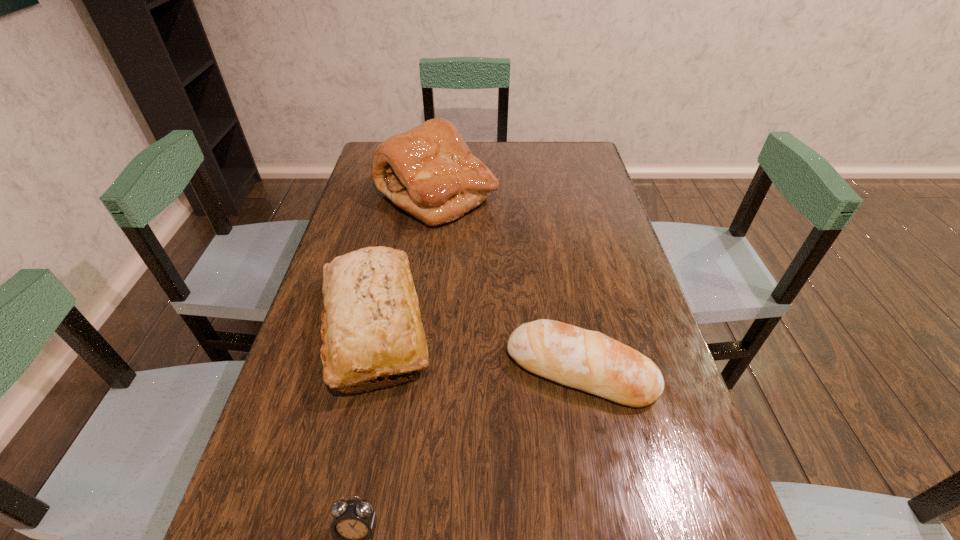
Locate an element on the screen. free point at the far edge is located at coordinates (483, 143).

Image resolution: width=960 pixels, height=540 pixels. In order to click on blank space at the left edge in this screenshot , I will do `click(300, 370)`.

Where is `free location at the right edge of the desktop`? free location at the right edge of the desktop is located at coordinates (601, 192).

Find the location of a particular element. The width and height of the screenshot is (960, 540). vacant space at the far right corner of the desktop is located at coordinates (589, 148).

Find the location of a particular element. The image size is (960, 540). free space between the shortest bread and the second shortest bread is located at coordinates (478, 348).

Identify which object is located as the second nearest to the shortest object. Please provide its 2D coordinates. Your answer should be formatted as a tuple, i.e. [(x, y)], where the tuple contains the x and y coordinates of a point satisfying the conditions above.

[(587, 360)]

Find the location of a particular element. This screenshot has width=960, height=540. object that ranks as the closest to the alarm clock is located at coordinates (371, 326).

Identify the location of the second closest bread to the tallest bread. (587, 360).

Where is `bread object that ranks as the second closest to the shortest bread`? The height and width of the screenshot is (540, 960). bread object that ranks as the second closest to the shortest bread is located at coordinates 428,171.

The height and width of the screenshot is (540, 960). I want to click on vacant space that satisfies the following two spatial constraints: 1. on the filling side of the shortest bread; 2. on the left side of the farthest object, so click(x=414, y=370).